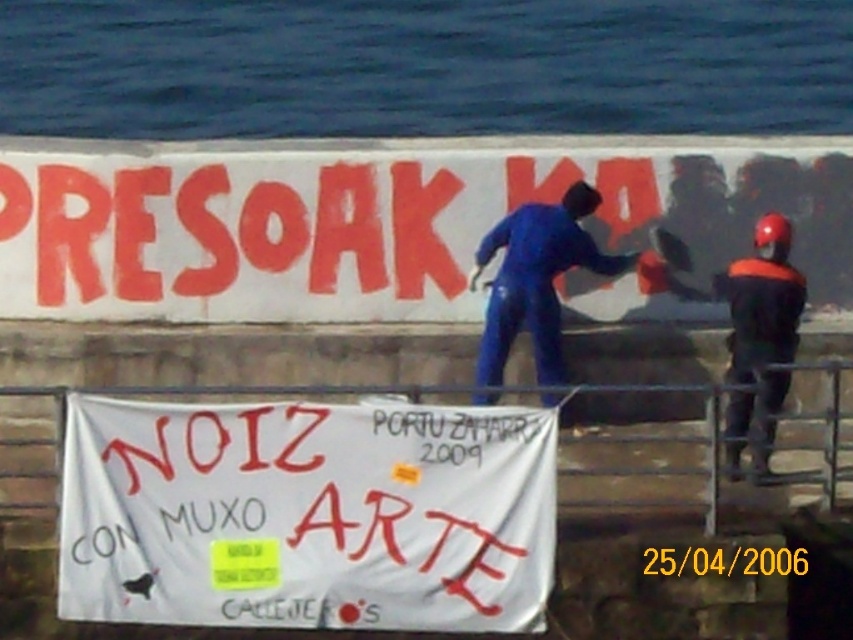
Question: Is blue rubber suit at center below metal/rusty rail at lower center?

Choices:
 (A) no
 (B) yes

Answer: (A)

Question: Which object is positioned farthest from the yellow paper sticker at lower center?

Choices:
 (A) blue water at upper center
 (B) white paper banner at lower center
 (C) metal/rusty rail at lower center
 (D) blue rubber suit at center

Answer: (A)

Question: From the image, what is the correct spatial relationship of white paper banner at lower center in relation to blue rubber suit at center?

Choices:
 (A) left
 (B) right

Answer: (A)

Question: Which point appears closest to the camera in this image?

Choices:
 (A) (677, 557)
 (B) (218, 520)
 (C) (529, 387)

Answer: (B)

Question: Is white paper banner at lower center smaller than blue rubber suit at center?

Choices:
 (A) yes
 (B) no

Answer: (A)

Question: Estimate the real-world distances between objects in this image. Which object is farther from the yellow paper sticker at lower center?

Choices:
 (A) metal/rusty rail at lower center
 (B) blue water at upper center

Answer: (B)